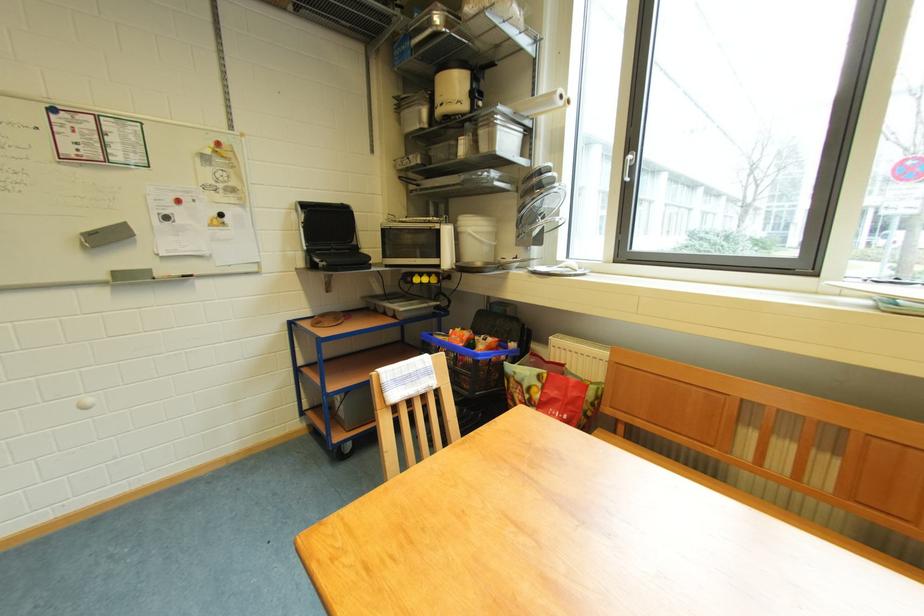
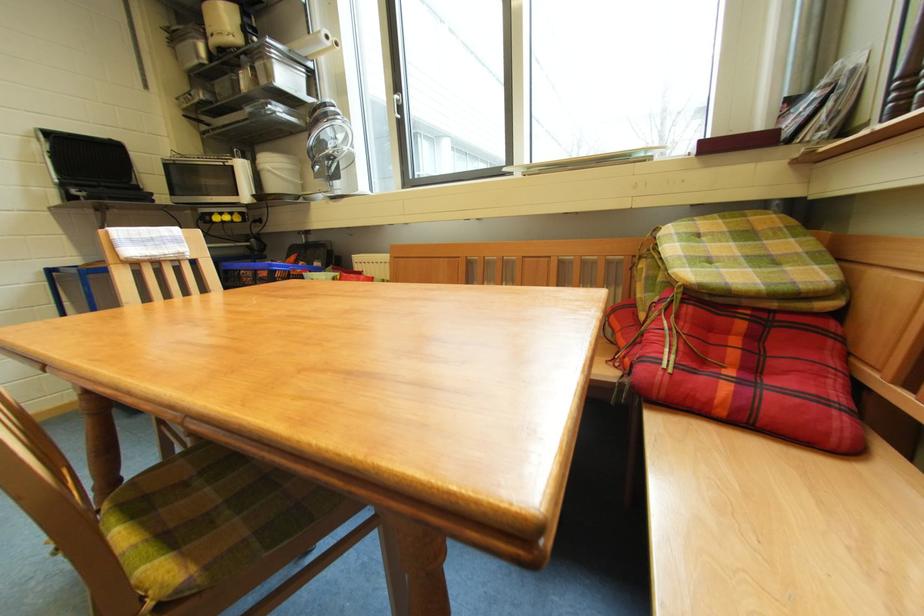
Find the pixel in the second image that matches point (412, 376) in the first image.

(153, 238)